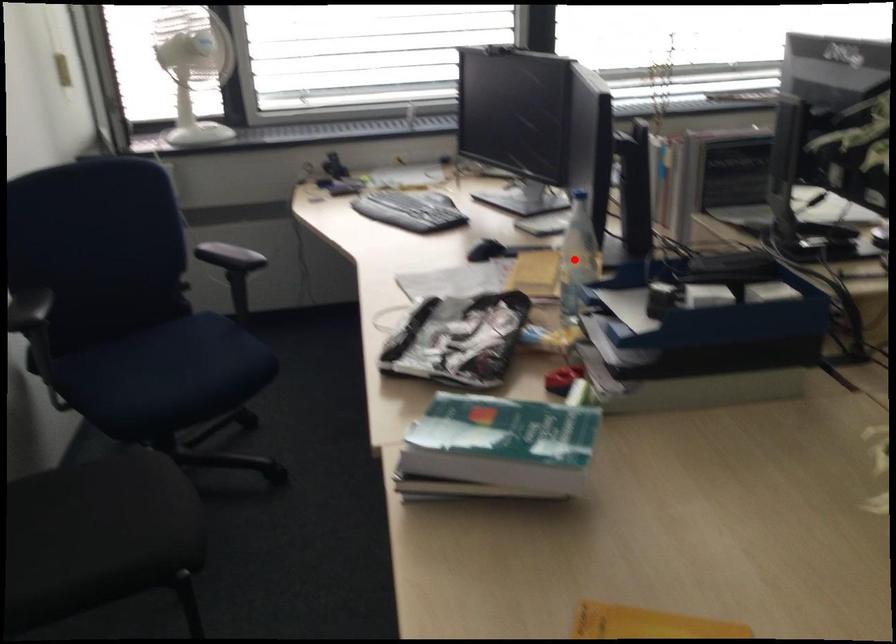
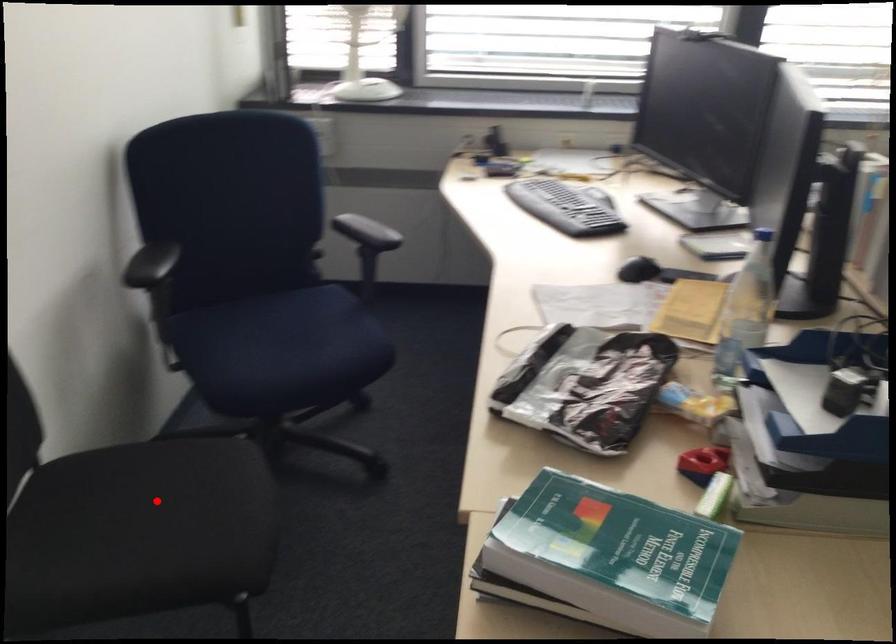
I am providing you with two images of the same scene from different viewpoints. A red point is marked on the first image and another point is marked on the second image. Is the red point in image1 aligned with the point shown in image2?

No